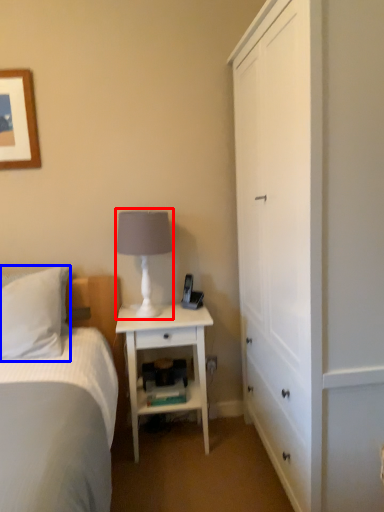
Question: Which object appears farthest to the camera in this image, table lamp (highlighted by a red box) or pillow (highlighted by a blue box)?

Choices:
 (A) table lamp
 (B) pillow

Answer: (A)